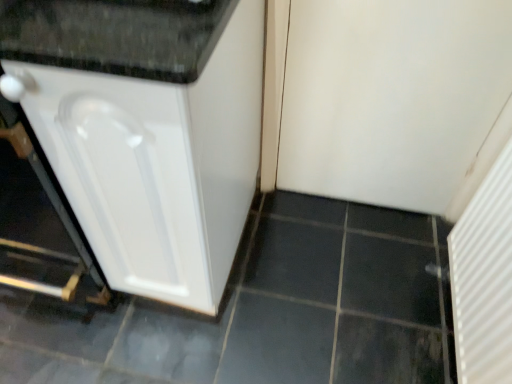
Question: Is white matte door at upper right, arranged as the 2th screen door when ordered from the bottom, far away from white glossy cabinet at left?

Choices:
 (A) yes
 (B) no

Answer: (B)

Question: Can you confirm if white matte door at upper right, the first screen door positioned from the top, is thinner than white glossy cabinet at left?

Choices:
 (A) no
 (B) yes

Answer: (B)

Question: From the image's perspective, is white matte door at upper right, the first screen door positioned from the top, above white glossy cabinet at left?

Choices:
 (A) no
 (B) yes

Answer: (B)

Question: Is white matte door at upper right, arranged as the 2th screen door when ordered from the bottom, directly adjacent to white glossy cabinet at left?

Choices:
 (A) yes
 (B) no

Answer: (B)

Question: Is white matte door at upper right, arranged as the 2th screen door when ordered from the bottom, aimed at white glossy cabinet at left?

Choices:
 (A) yes
 (B) no

Answer: (B)

Question: In terms of size, does white glossy cabinet at left appear bigger or smaller than white textured radiator at right, the 1th screen door positioned from the bottom?

Choices:
 (A) big
 (B) small

Answer: (A)

Question: Is white glossy cabinet at left to the left or to the right of white textured radiator at right, the 2th screen door in the top-to-bottom sequence, in the image?

Choices:
 (A) right
 (B) left

Answer: (B)

Question: From a real-world perspective, relative to white textured radiator at right, the 1th screen door positioned from the bottom, is white glossy cabinet at left vertically above or below?

Choices:
 (A) above
 (B) below

Answer: (A)

Question: Relative to white textured radiator at right, the 2th screen door in the top-to-bottom sequence, is white glossy cabinet at left in front or behind?

Choices:
 (A) front
 (B) behind

Answer: (A)

Question: Is white textured radiator at right, the 1th screen door positioned from the bottom, in front of or behind white glossy cabinet at left in the image?

Choices:
 (A) behind
 (B) front

Answer: (A)

Question: Considering the positions of white textured radiator at right, the 1th screen door positioned from the bottom, and white glossy cabinet at left in the image, is white textured radiator at right, the 1th screen door positioned from the bottom, wider or thinner than white glossy cabinet at left?

Choices:
 (A) thin
 (B) wide

Answer: (A)

Question: From a real-world perspective, is white textured radiator at right, the 2th screen door in the top-to-bottom sequence, above or below white glossy cabinet at left?

Choices:
 (A) below
 (B) above

Answer: (A)

Question: Considering the positions of point (507, 231) and point (129, 23), is point (507, 231) closer or farther from the camera than point (129, 23)?

Choices:
 (A) farther
 (B) closer

Answer: (A)

Question: Is white matte door at upper right, arranged as the 2th screen door when ordered from the bottom, taller or shorter than white textured radiator at right, the 1th screen door positioned from the bottom?

Choices:
 (A) short
 (B) tall

Answer: (B)

Question: Based on their positions, is white matte door at upper right, the first screen door positioned from the top, located to the left or right of white textured radiator at right, the 2th screen door in the top-to-bottom sequence?

Choices:
 (A) right
 (B) left

Answer: (B)